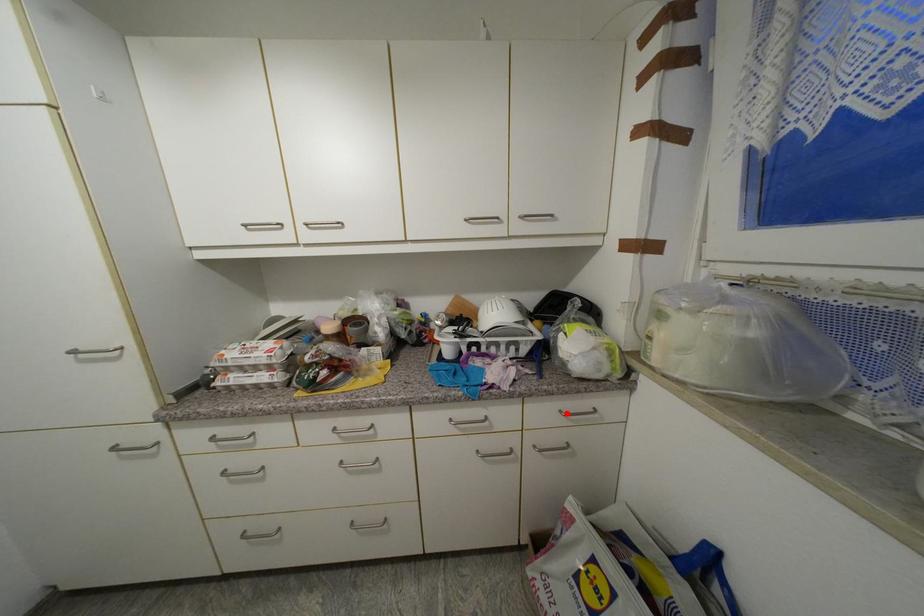
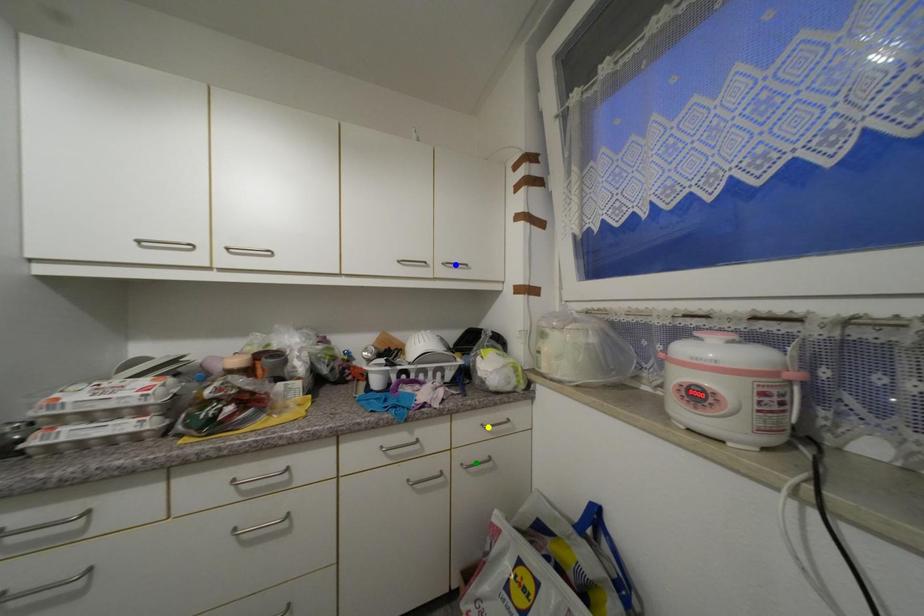
Question: I am providing you with two images of the same scene from different viewpoints. A red point is marked on the first image. You are given multiple points on the second image. Which point in image 2 represents the same 3d spot as the red point in image 1?

Choices:
 (A) green point
 (B) yellow point
 (C) blue point

Answer: (B)